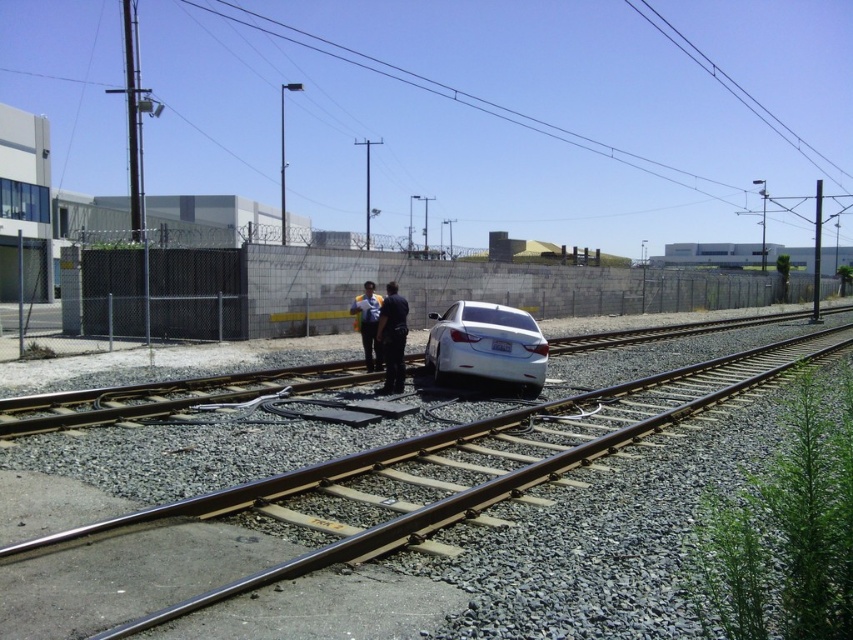
Question: Among these objects, which one is nearest to the camera?

Choices:
 (A) smooth metal train track at center
 (B) dark blue uniform at center

Answer: (A)

Question: Can you confirm if smooth metal train track at center is positioned to the right of satin silver sedan at center?

Choices:
 (A) no
 (B) yes

Answer: (B)

Question: Does dark blue uniform at center have a larger size compared to blue shirt at center?

Choices:
 (A) no
 (B) yes

Answer: (A)

Question: Is smooth metal train track at center smaller than satin silver sedan at center?

Choices:
 (A) yes
 (B) no

Answer: (B)

Question: Which point is closer to the camera?

Choices:
 (A) (375, 333)
 (B) (693, 404)
 (C) (366, 284)
 (D) (445, 356)

Answer: (B)

Question: Which object is closer to the camera taking this photo?

Choices:
 (A) satin silver sedan at center
 (B) dark blue uniform at center

Answer: (B)